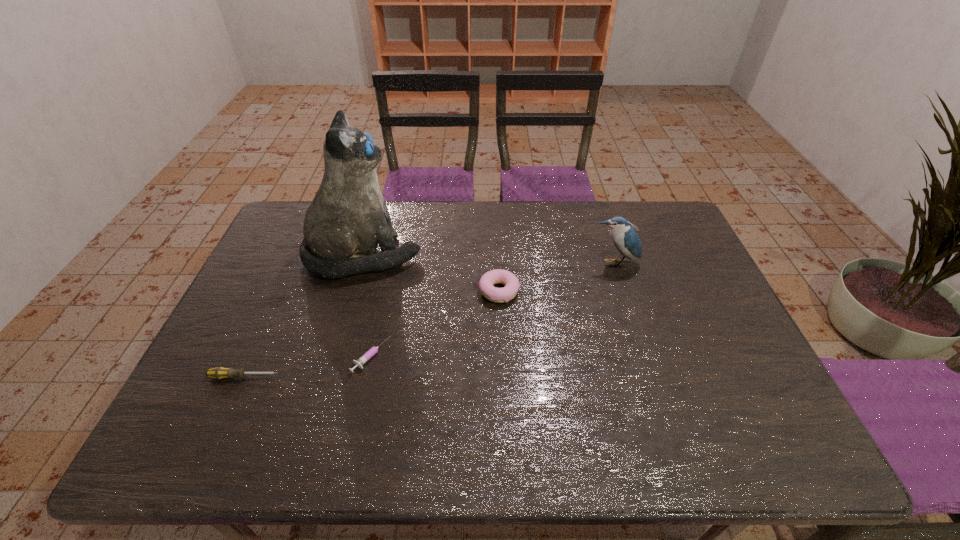
Image resolution: width=960 pixels, height=540 pixels. Identify the location of free space located 0.380m at the tip of the screwdriver. (434, 377).

Find the location of a particular element. vacant region located 0.340m on the left of the shortest object is located at coordinates (221, 356).

Where is `object situated at the far edge`? object situated at the far edge is located at coordinates (348, 217).

You are a GUI agent. You are given a task and a screenshot of the screen. Output one action in this format:
    pyautogui.click(x=<x>, y=<y>)
    Task: Click on the cat located at the left edge
    The image size is (960, 540).
    Given the screenshot: What is the action you would take?
    pyautogui.click(x=348, y=217)

The height and width of the screenshot is (540, 960). In order to click on screwdriver located at the left edge in this screenshot , I will do `click(218, 373)`.

Where is `object that is positioned at the far left corner`? object that is positioned at the far left corner is located at coordinates (348, 217).

Find the location of a particular element. blank space at the far edge of the desktop is located at coordinates (437, 228).

In order to click on blank area at the near edge in this screenshot , I will do `click(713, 433)`.

The height and width of the screenshot is (540, 960). In order to click on vacant space at the right edge of the desktop in this screenshot , I will do click(x=665, y=300).

In the image, there is a desktop. Where is `free region at the far left corner`? This screenshot has height=540, width=960. free region at the far left corner is located at coordinates [281, 226].